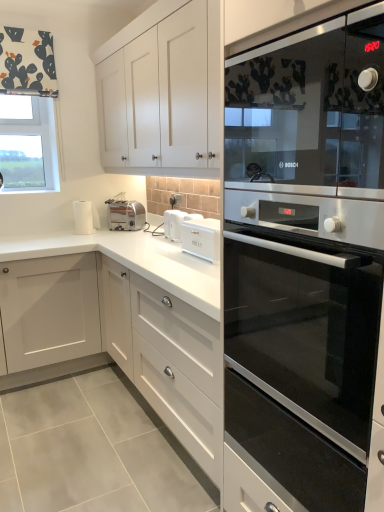
Describe the element at coordinates (305, 268) in the screenshot. I see `black glass oven at right` at that location.

Measure the distance between white plastic toaster at center, marked as the second appliance in a left-to-right arrangement, and camera.

white plastic toaster at center, marked as the second appliance in a left-to-right arrangement, and camera are 2.23 meters apart.

What is the approximate height of satin silver toaster at center, marked as the first appliance in a back-to-front arrangement?

satin silver toaster at center, marked as the first appliance in a back-to-front arrangement, is 9.36 inches tall.

Where is `satin silver toaster at center, which is the second appliance in front-to-back order`? Image resolution: width=384 pixels, height=512 pixels. satin silver toaster at center, which is the second appliance in front-to-back order is located at coordinates (126, 215).

The height and width of the screenshot is (512, 384). I want to click on white glossy cabinet at lower right, so click(x=124, y=322).

At what (x,y) coordinates should I click in order to perform the action: click on clear glass window at upper left. Please return your answer as a coordinate pair (x, y). This screenshot has width=384, height=512. Looking at the image, I should click on (28, 145).

Where is `the 1st appliance above the white glossy cabinet at lower right (from the image's perspective)`? Image resolution: width=384 pixels, height=512 pixels. the 1st appliance above the white glossy cabinet at lower right (from the image's perspective) is located at coordinates (176, 223).

Is white plastic toaster at center, the first appliance positioned from the right, beside white glossy cabinet at lower right?

No, white plastic toaster at center, the first appliance positioned from the right, is not next to white glossy cabinet at lower right.

What's the angular difference between white plastic toaster at center, marked as the second appliance in a left-to-right arrangement, and white glossy cabinet at lower right's facing directions?

The facing directions of white plastic toaster at center, marked as the second appliance in a left-to-right arrangement, and white glossy cabinet at lower right are 89.4 degrees apart.

Is white plastic toaster at center, the first appliance from the front, turned away from white glossy cabinet at lower right?

No, white plastic toaster at center, the first appliance from the front, is not facing the opposite direction of white glossy cabinet at lower right.

In the image, is black glass microwave at upper right positioned in front of or behind stainless steel oven at right?

Clearly, black glass microwave at upper right is in front of stainless steel oven at right.

How far apart are black glass microwave at upper right and stainless steel oven at right?

black glass microwave at upper right is 13.65 inches from stainless steel oven at right.

Is black glass microwave at upper right in contact with stainless steel oven at right?

No.

Locate an element on the screen. The width and height of the screenshot is (384, 512). microwave oven above the stainless steel oven at right (from a real-world perspective) is located at coordinates (309, 106).

Find the location of a particular element. This screenshot has width=384, height=512. oven in front of the clear glass window at upper left is located at coordinates (305, 327).

Is stainless steel oven at right surrounding clear glass window at upper left?

No, clear glass window at upper left is located outside of stainless steel oven at right.

From a real-world perspective, is stainless steel oven at right positioned above or below clear glass window at upper left?

Clearly, from a real-world perspective, stainless steel oven at right is below clear glass window at upper left.

Are clear glass window at upper left and black glass microwave at upper right located far from each other?

Yes, clear glass window at upper left is far from black glass microwave at upper right.

Is clear glass window at upper left thinner than black glass microwave at upper right?

Indeed, clear glass window at upper left has a lesser width compared to black glass microwave at upper right.

Is clear glass window at upper left surrounding black glass microwave at upper right?

Definitely not — black glass microwave at upper right is not inside clear glass window at upper left.

Considering the relative positions of clear glass window at upper left and black glass microwave at upper right in the image provided, is clear glass window at upper left to the left or to the right of black glass microwave at upper right?

In the image, clear glass window at upper left appears on the left side of black glass microwave at upper right.

Is clear glass window at upper left located within black glass microwave at upper right?

No, clear glass window at upper left is not a part of black glass microwave at upper right.

From a real-world perspective, is black glass microwave at upper right above or below clear glass window at upper left?

black glass microwave at upper right is below clear glass window at upper left.

Is black glass microwave at upper right far away from clear glass window at upper left?

That's right, there is a large distance between black glass microwave at upper right and clear glass window at upper left.

Would you say white glossy cabinet at lower right is part of satin silver toaster at center, arranged as the first appliance when viewed from the left,'s contents?

Definitely not — white glossy cabinet at lower right is not inside satin silver toaster at center, arranged as the first appliance when viewed from the left.

Between satin silver toaster at center, arranged as the first appliance when viewed from the left, and white glossy cabinet at lower right, which one is positioned in front?

white glossy cabinet at lower right is more forward.

Image resolution: width=384 pixels, height=512 pixels. Find the location of `appliance that is the 2nd object located behind the white glossy cabinet at lower right`. appliance that is the 2nd object located behind the white glossy cabinet at lower right is located at coordinates (126, 215).

From the image's perspective, is satin silver toaster at center, arranged as the first appliance when viewed from the left, on top of white glossy cabinet at lower right?

Yes, from the image's perspective, satin silver toaster at center, arranged as the first appliance when viewed from the left, is over white glossy cabinet at lower right.

Is stainless steel oven at right looking in the opposite direction of white glossy cabinet at lower right?

That's not correct — stainless steel oven at right is not looking away from white glossy cabinet at lower right.

Is stainless steel oven at right taller or shorter than white glossy cabinet at lower right?

Clearly, stainless steel oven at right is shorter compared to white glossy cabinet at lower right.

In terms of size, does stainless steel oven at right appear bigger or smaller than white glossy cabinet at lower right?

stainless steel oven at right is smaller than white glossy cabinet at lower right.

Is stainless steel oven at right completely or partially outside of white glossy cabinet at lower right?

Yes, stainless steel oven at right is not within white glossy cabinet at lower right.

At what (x,y) coordinates should I click in order to perform the action: click on cabinetry in front of the white plastic toaster at center, positioned as the 2th appliance in back-to-front order. Please return your answer as a coordinate pair (x, y). The image size is (384, 512). Looking at the image, I should click on (124, 322).

Find the location of a particular element. The image size is (384, 512). microwave oven on the left of stainless steel oven at right is located at coordinates (309, 106).

From the image, which object appears to be nearer to black glass oven at right, white plastic toaster at center, the first appliance positioned from the right, or white glossy cabinet at lower right?

white glossy cabinet at lower right lies closer to black glass oven at right than the other object.

From the image, which object appears to be nearer to white plastic toaster at center, positioned as the 2th appliance in back-to-front order, stainless steel oven at right or clear glass window at upper left?

clear glass window at upper left is closer to white plastic toaster at center, positioned as the 2th appliance in back-to-front order.

Estimate the real-world distances between objects in this image. Which object is closer to clear glass window at upper left, stainless steel oven at right or white plastic toaster at center, the first appliance from the front?

The object closer to clear glass window at upper left is white plastic toaster at center, the first appliance from the front.

From the image, which object appears to be nearer to black glass microwave at upper right, clear glass window at upper left or stainless steel oven at right?

stainless steel oven at right is closer to black glass microwave at upper right.

Looking at this image, based on their spatial positions, is clear glass window at upper left or satin silver toaster at center, arranged as the first appliance when viewed from the left, closer to white glossy cabinet at lower right?

satin silver toaster at center, arranged as the first appliance when viewed from the left, is closer to white glossy cabinet at lower right.

Which object lies further to the anchor point black glass oven at right, white plastic toaster at center, positioned as the 2th appliance in back-to-front order, or stainless steel oven at right?

Based on the image, white plastic toaster at center, positioned as the 2th appliance in back-to-front order, appears to be further to black glass oven at right.

Which object lies nearer to the anchor point clear glass window at upper left, black glass microwave at upper right or white plastic toaster at center, the first appliance positioned from the right?

white plastic toaster at center, the first appliance positioned from the right, is closer to clear glass window at upper left.

From the image, which object appears to be nearer to stainless steel oven at right, clear glass window at upper left or black glass oven at right?

Based on the image, black glass oven at right appears to be nearer to stainless steel oven at right.

This screenshot has height=512, width=384. Find the location of `microwave oven located between black glass oven at right and satin silver toaster at center, the 2th appliance in the right-to-left sequence, in the depth direction`. microwave oven located between black glass oven at right and satin silver toaster at center, the 2th appliance in the right-to-left sequence, in the depth direction is located at coordinates (309, 106).

This screenshot has height=512, width=384. I want to click on cabinetry positioned between black glass oven at right and white plastic toaster at center, the first appliance from the front, from near to far, so click(x=124, y=322).

Find the location of `window positioned between black glass oven at right and satin silver toaster at center, arranged as the first appliance when viewed from the left, from near to far`. window positioned between black glass oven at right and satin silver toaster at center, arranged as the first appliance when viewed from the left, from near to far is located at coordinates (28, 145).

At what (x,y) coordinates should I click in order to perform the action: click on oven positioned between black glass microwave at upper right and white plastic toaster at center, marked as the second appliance in a left-to-right arrangement, from near to far. Please return your answer as a coordinate pair (x, y). Looking at the image, I should click on (305, 327).